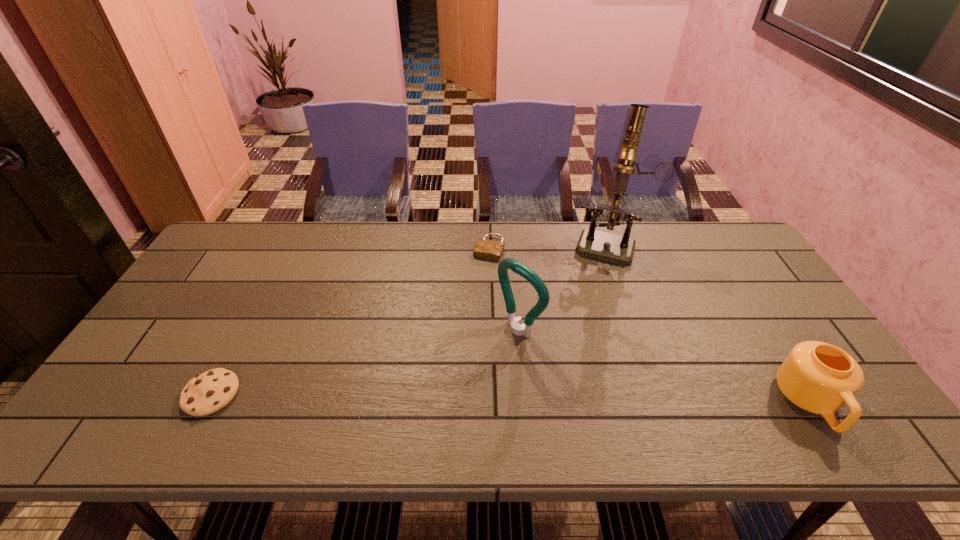
Image resolution: width=960 pixels, height=540 pixels. Find the location of `free spot that satisfies the following two spatial constraints: 1. on the back side of the third nearest object; 2. on the right side of the second object from right to left`. free spot that satisfies the following two spatial constraints: 1. on the back side of the third nearest object; 2. on the right side of the second object from right to left is located at coordinates (512, 244).